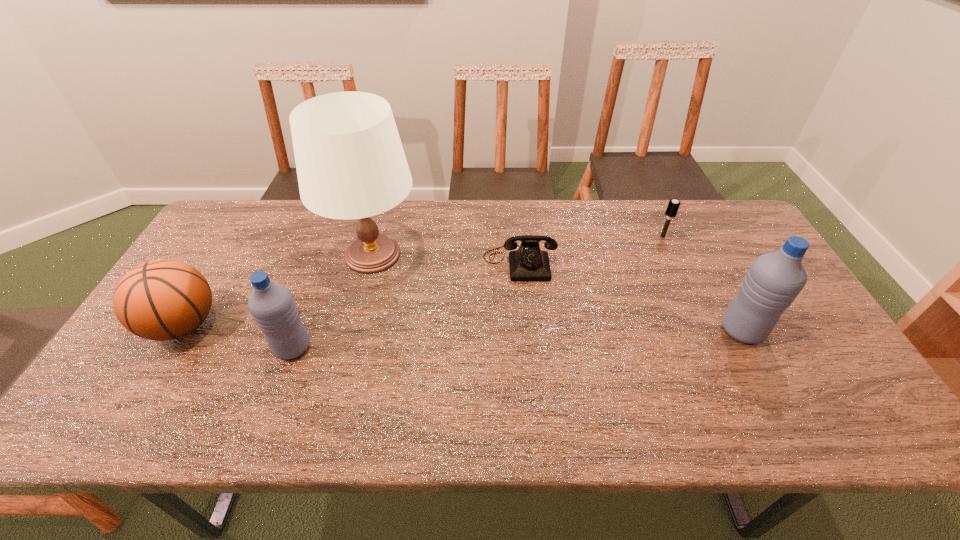
You are a GUI agent. You are given a task and a screenshot of the screen. Output one action in this format:
    pyautogui.click(x=<x>, y=<y>)
    Task: Click on the free space between the shorter water bottle and the lamp
    
    Given the screenshot: What is the action you would take?
    [332, 301]

In order to click on empty location between the right water bottle and the third shortest object in this screenshot , I will do `click(463, 327)`.

Image resolution: width=960 pixels, height=540 pixels. In order to click on unoccupied position between the taller water bottle and the basketball in this screenshot , I will do `click(463, 327)`.

The image size is (960, 540). What are the coordinates of `free area in between the basketball and the shorter water bottle` in the screenshot? It's located at (238, 336).

Identify the location of free space between the leftmost object and the telephone. This screenshot has height=540, width=960. (351, 293).

In order to click on free space between the fifth object from left to right and the left water bottle in this screenshot , I will do `click(477, 292)`.

Identify the location of the third closest object to the telephone. (774, 280).

Locate an element on the screen. This screenshot has width=960, height=540. object that is the third closest to the basketball is located at coordinates (529, 263).

The width and height of the screenshot is (960, 540). What are the coordinates of `vacant region that satisfies the following two spatial constraints: 1. on the back side of the shorter water bottle; 2. on the left side of the hairbrush` in the screenshot? It's located at (333, 236).

Identify the location of free location that satisfies the following two spatial constraints: 1. on the back side of the fifth shortest object; 2. on the left side of the shorter water bottle. Image resolution: width=960 pixels, height=540 pixels. (299, 330).